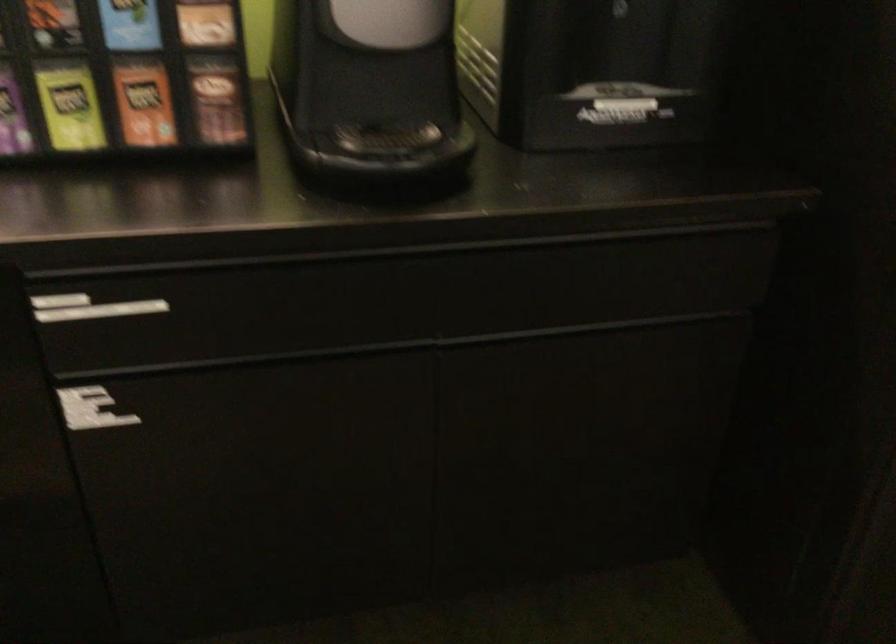
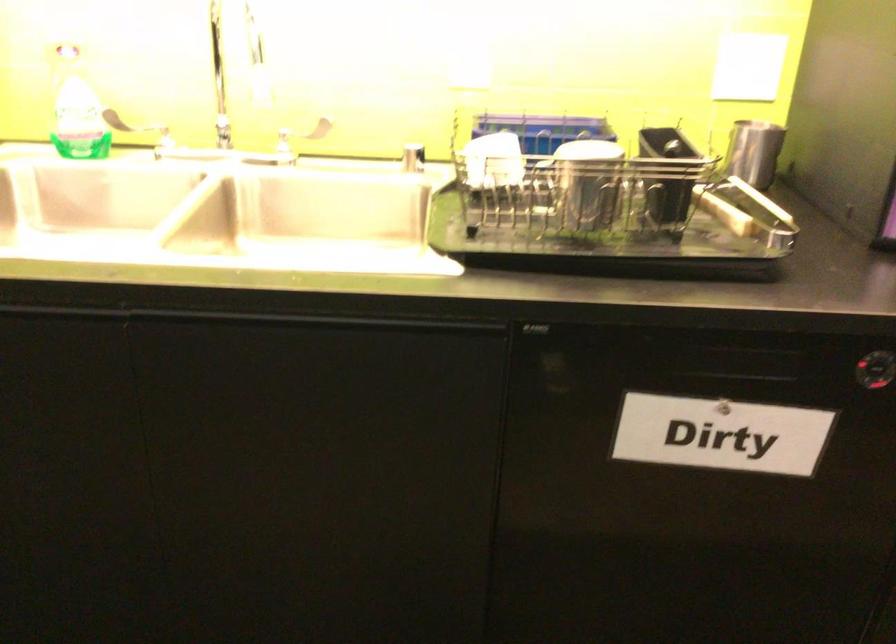
Question: What movement of the cameraman would produce the second image?

Choices:
 (A) Left
 (B) Right
 (C) Forward
 (D) Backward

Answer: (A)